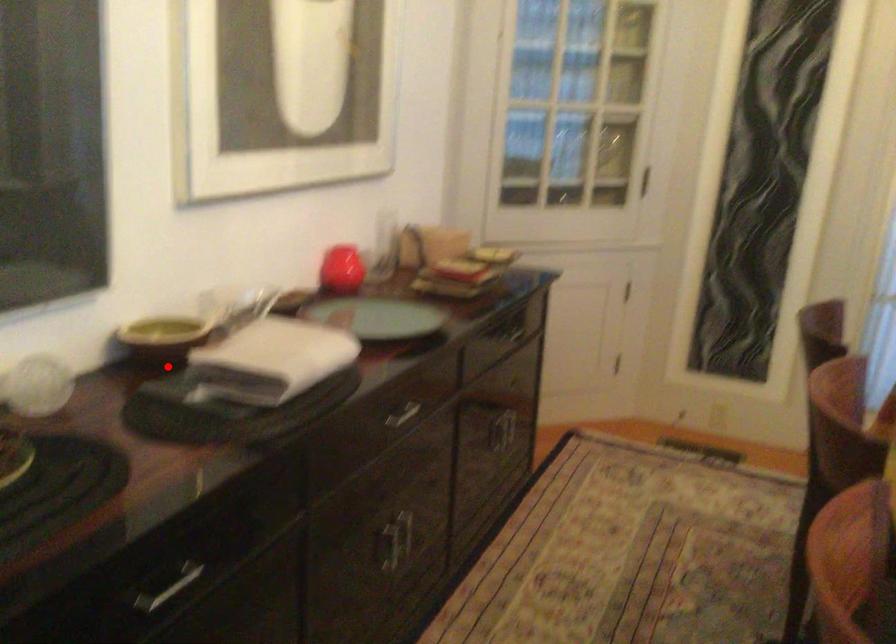
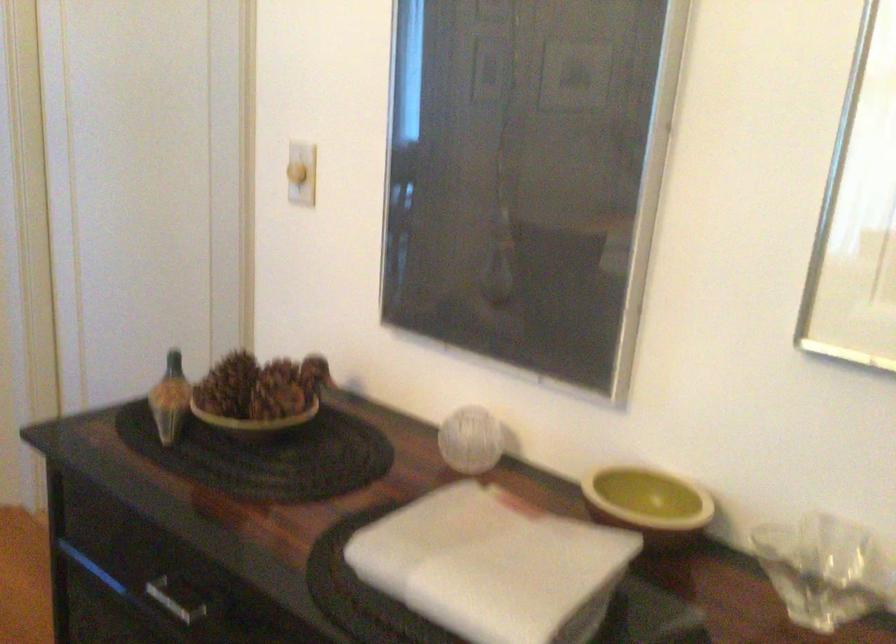
In the second image, find the point that corresponds to the highlighted location in the first image.

(648, 503)